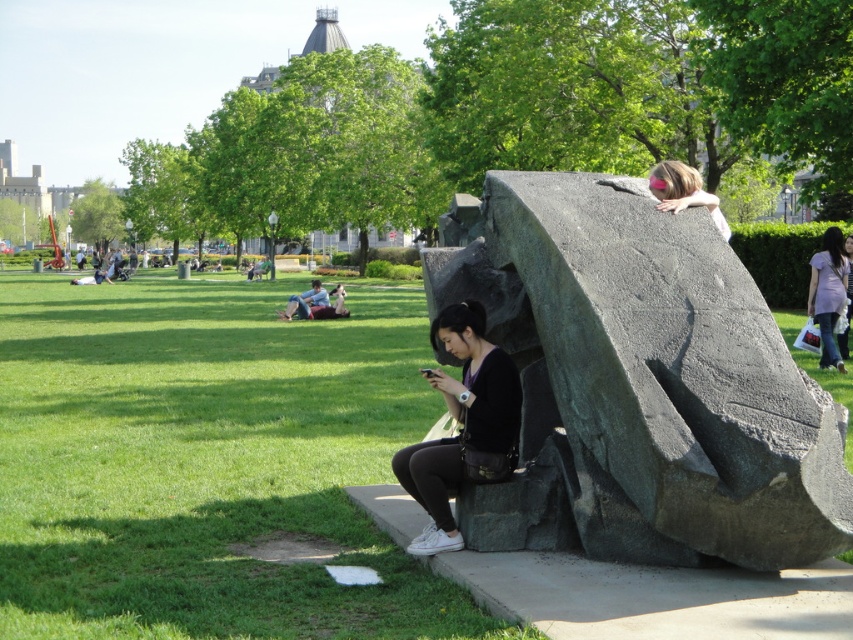
Question: Is purple cotton shirt at upper right further to the viewer compared to pink matte rock at upper right?

Choices:
 (A) no
 (B) yes

Answer: (B)

Question: Which of the following is the closest to the observer?

Choices:
 (A) (682, 179)
 (B) (653, 509)
 (C) (838, 276)

Answer: (B)

Question: Can you confirm if green grass at lower left is positioned to the left of purple cotton shirt at upper right?

Choices:
 (A) yes
 (B) no

Answer: (A)

Question: Estimate the real-world distances between objects in this image. Which object is closer to the matte black dress at right?

Choices:
 (A) black matte shirt at center
 (B) pink matte rock at upper right
 (C) green grass at lower left
 (D) purple cotton shirt at upper right

Answer: (D)

Question: Which of these objects is positioned farthest from the dark gray stone sculpture at center?

Choices:
 (A) black matte shirt at center
 (B) purple cotton shirt at upper right
 (C) green grass at lower left

Answer: (B)

Question: Does purple cotton shirt at upper right have a smaller size compared to matte black dress at right?

Choices:
 (A) no
 (B) yes

Answer: (B)